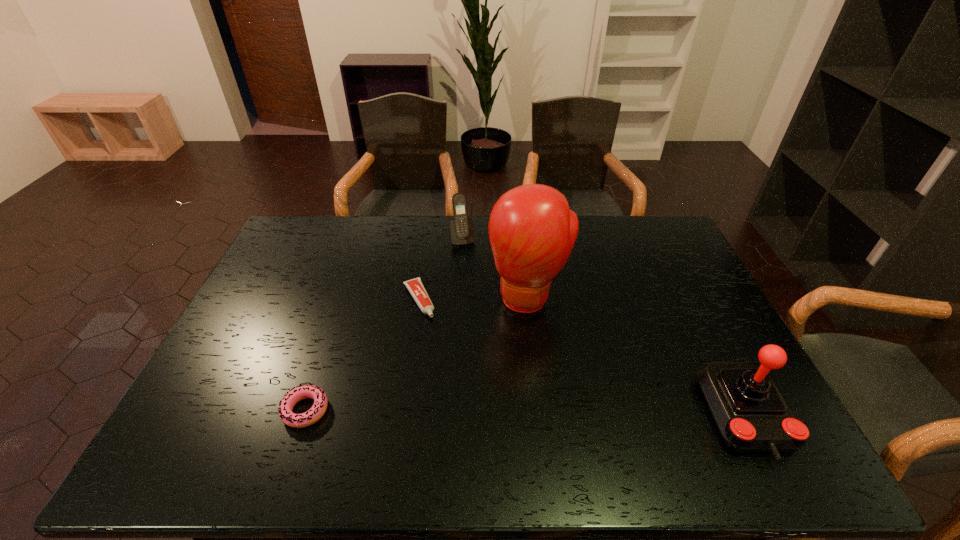
Locate an element on the screen. the leftmost object is located at coordinates 301,392.

At what (x,y) coordinates should I click in order to perform the action: click on the fourth shortest object. Please return your answer as a coordinate pair (x, y). Image resolution: width=960 pixels, height=540 pixels. Looking at the image, I should click on (751, 415).

Where is `the rightmost object`? This screenshot has width=960, height=540. the rightmost object is located at coordinates (751, 415).

At what (x,y) coordinates should I click in order to perform the action: click on toothpaste. Please return your answer as a coordinate pair (x, y). This screenshot has height=540, width=960. Looking at the image, I should click on (415, 286).

Image resolution: width=960 pixels, height=540 pixels. Find the location of `the farthest object`. the farthest object is located at coordinates (462, 231).

Find the location of a particular element. The width and height of the screenshot is (960, 540). the third tallest object is located at coordinates (462, 231).

You are a GUI agent. You are given a task and a screenshot of the screen. Output one action in this format:
    pyautogui.click(x=<x>, y=<y>)
    Task: Click on the tallest object
    This screenshot has height=540, width=960.
    Given the screenshot: What is the action you would take?
    pyautogui.click(x=532, y=231)

Locate an element on the screen. The height and width of the screenshot is (540, 960). the second object from right to left is located at coordinates (532, 231).

This screenshot has width=960, height=540. I want to click on vacant space located on the back of the leftmost object, so click(324, 357).

At what (x,y) coordinates should I click in order to perform the action: click on free region located 0.320m at the nozzle of the toothpaste. Please return your answer as a coordinate pair (x, y). Looking at the image, I should click on (468, 402).